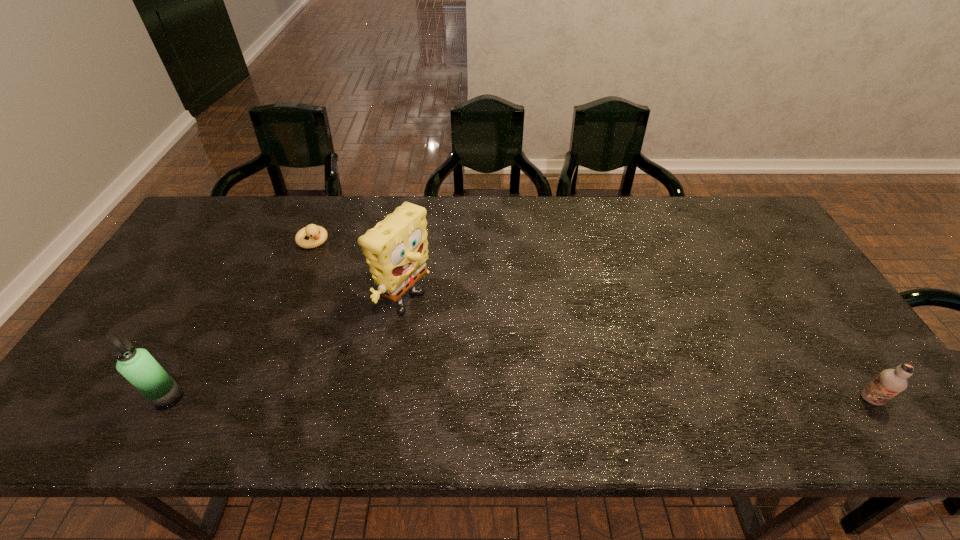
Identify the location of vacant region located 0.340m on the face of the sponge. This screenshot has height=540, width=960. (541, 388).

Where is `vacant space situated on the face of the sponge`? The image size is (960, 540). vacant space situated on the face of the sponge is located at coordinates [x=557, y=397].

The height and width of the screenshot is (540, 960). Identify the location of vacant space located 0.260m on the face of the sponge. (512, 372).

This screenshot has width=960, height=540. Identify the location of free space located at the beak of the shortest object. (348, 278).

Where is `vacant space situated at the beak of the shortest object`? The width and height of the screenshot is (960, 540). vacant space situated at the beak of the shortest object is located at coordinates (362, 293).

At what (x,y) coordinates should I click in order to perform the action: click on free region located at the beak of the shortest object. Please return your answer as a coordinate pair (x, y). Looking at the image, I should click on (358, 289).

The width and height of the screenshot is (960, 540). Identify the location of object positioned at the far edge. (317, 235).

Identify the location of thermos bottle positioned at the near edge. (137, 365).

Find the location of a particular element. The width and height of the screenshot is (960, 540). chocolate milk that is at the near edge is located at coordinates (890, 382).

Image resolution: width=960 pixels, height=540 pixels. I want to click on object located in the right edge section of the desktop, so point(890,382).